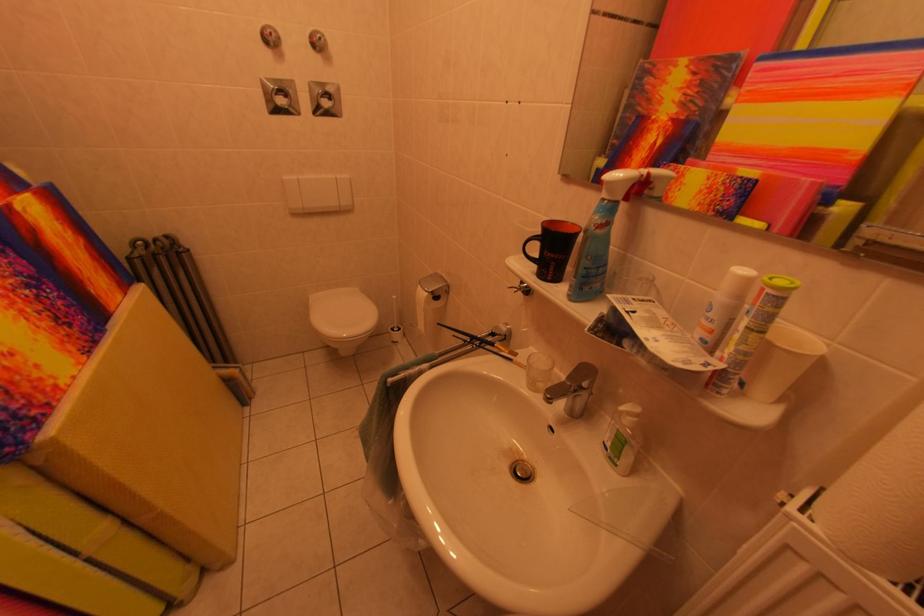
Find the location of a particular element. The image size is (924, 616). soap dispenser pump is located at coordinates click(609, 225).